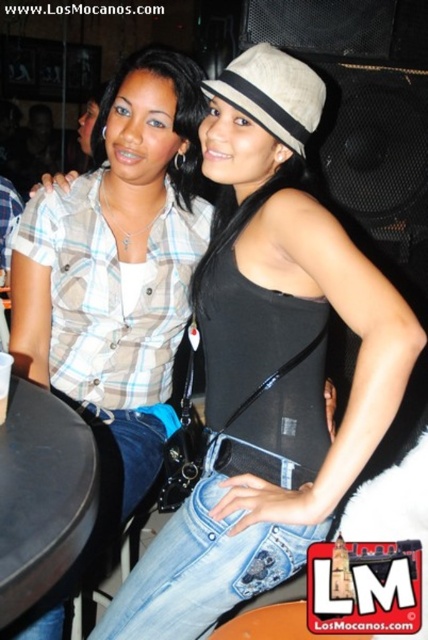
Is denim jeans at lower center bigger than beige fabric hat at center?

Yes, denim jeans at lower center is bigger than beige fabric hat at center.

Which of these two, denim jeans at lower center or beige fabric hat at center, stands shorter?

beige fabric hat at center

Is point (219, 540) in front of point (291, 93)?

No.

Locate an element on the screen. denim jeans at lower center is located at coordinates (202, 568).

From the picture: Who is shorter, plaid shirt at left or black plastic table at lower left?

black plastic table at lower left is shorter.

Is plaid shirt at left wider than black plastic table at lower left?

Yes, plaid shirt at left is wider than black plastic table at lower left.

What do you see at coordinates (115, 285) in the screenshot? I see `plaid shirt at left` at bounding box center [115, 285].

What are the coordinates of `plaid shirt at left` in the screenshot? It's located at (115, 285).

Does plaid shirt at left come behind denim jeans at lower center?

Yes, it is.

Is plaid shirt at left above denim jeans at lower center?

Correct, plaid shirt at left is located above denim jeans at lower center.

Between point (155, 166) and point (270, 577), which one is positioned behind?

Point (155, 166)

I want to click on plaid shirt at left, so click(x=115, y=285).